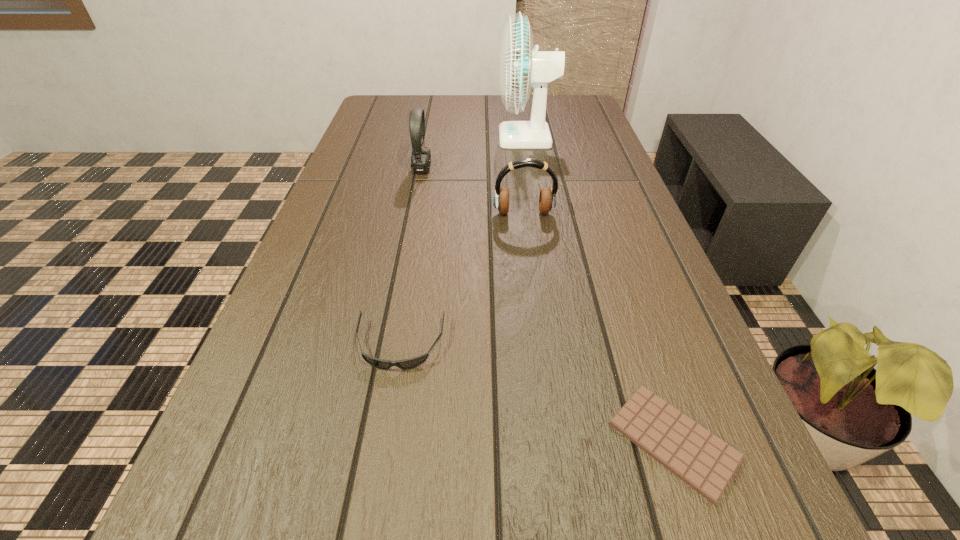
The height and width of the screenshot is (540, 960). I want to click on vacant space located 0.130m in front of the tallest object to face the airflow, so click(x=456, y=138).

I want to click on vacant space situated 0.260m on the front-facing side of the left headset, so click(x=525, y=169).

This screenshot has height=540, width=960. What are the coordinates of `vacant space located 0.250m on the ear cup of the third farthest object` in the screenshot? It's located at (534, 294).

The width and height of the screenshot is (960, 540). What are the coordinates of `vacant space situated 0.050m on the front-facing side of the second shortest object` in the screenshot? It's located at (391, 398).

I want to click on object at the far edge, so pyautogui.click(x=521, y=66).

Locate an element on the screen. fan that is positioned at the right edge is located at coordinates (521, 66).

You are a GUI agent. You are given a task and a screenshot of the screen. Output one action in this format:
    pyautogui.click(x=<x>, y=<y>)
    Task: Click on the chocolate bar located at the right edge
    
    Given the screenshot: What is the action you would take?
    click(x=706, y=463)

You are a GUI agent. You are given a task and a screenshot of the screen. Output one action in this format:
    pyautogui.click(x=<x>, y=<y>)
    Task: Click on the object situated at the far right corner
    Image resolution: width=960 pixels, height=540 pixels.
    Given the screenshot: What is the action you would take?
    pyautogui.click(x=521, y=66)

Locate an element on the screen. This screenshot has height=540, width=960. vacant space at the far edge of the desktop is located at coordinates (465, 108).

The height and width of the screenshot is (540, 960). In the image, there is a desktop. In order to click on vacant space at the left edge in this screenshot , I will do `click(366, 149)`.